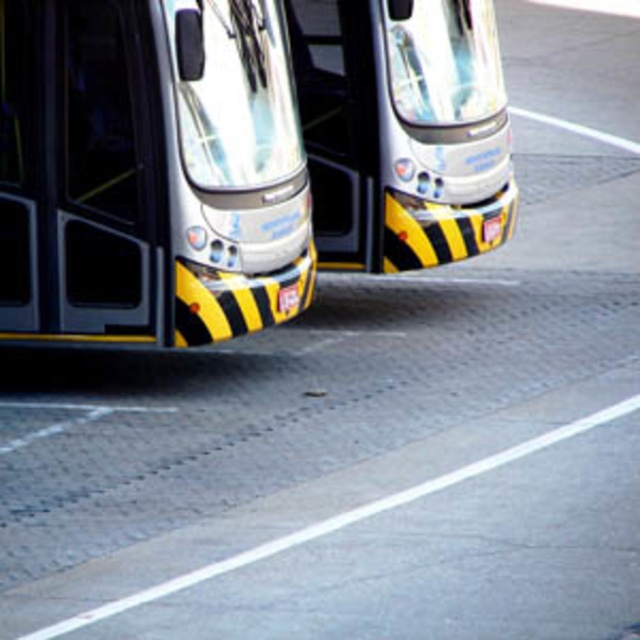
Who is more distant from viewer, (x=74, y=19) or (x=300, y=104)?

The point (x=300, y=104) is behind.

Who is lower down, yellow and black striped bumper at center or metallic silver bus at center?

yellow and black striped bumper at center is lower down.

Locate an element on the screen. The image size is (640, 640). yellow and black striped bumper at center is located at coordinates (148, 172).